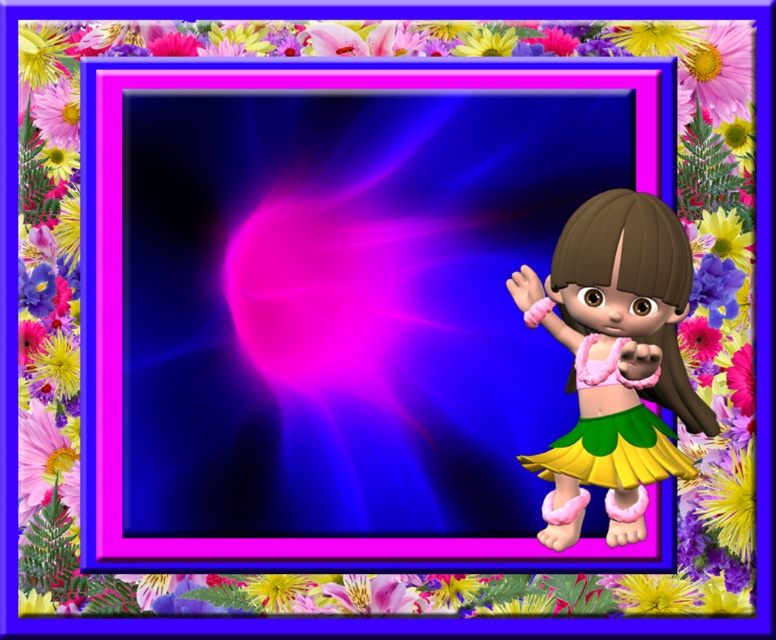
Question: Does shiny pink fabric skirt at right have a smaller size compared to green fabric skirt at lower right?

Choices:
 (A) yes
 (B) no

Answer: (B)

Question: Which object appears closest to the camera in this image?

Choices:
 (A) green fabric skirt at lower right
 (B) shiny pink fabric skirt at right

Answer: (B)

Question: Is shiny pink fabric skirt at right below green fabric skirt at lower right?

Choices:
 (A) yes
 (B) no

Answer: (B)

Question: Which of the following is the farthest from the observer?

Choices:
 (A) shiny pink fabric skirt at right
 (B) green fabric skirt at lower right

Answer: (B)

Question: Can you confirm if shiny pink fabric skirt at right is wider than green fabric skirt at lower right?

Choices:
 (A) no
 (B) yes

Answer: (B)